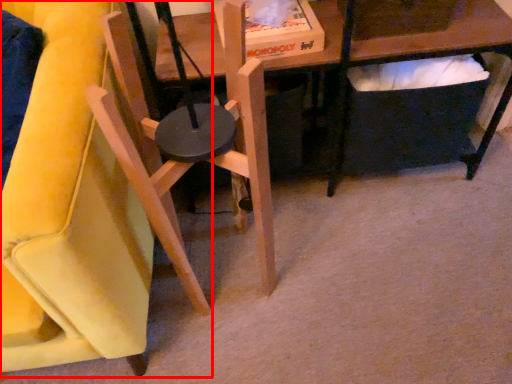
Question: Observing the image, what is the correct spatial positioning of chair (annotated by the red box) in reference to chair?

Choices:
 (A) right
 (B) left

Answer: (B)